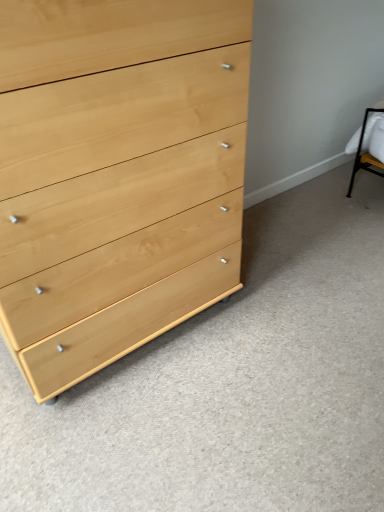
What do you see at coordinates (117, 174) in the screenshot? This screenshot has height=512, width=384. I see `light wood dresser at left` at bounding box center [117, 174].

In the scene shown: Measure the distance between light wood dresser at left and camera.

29.53 inches.

The image size is (384, 512). I want to click on light wood dresser at left, so click(x=117, y=174).

Identify the location of light wood dresser at left. This screenshot has height=512, width=384. tap(117, 174).